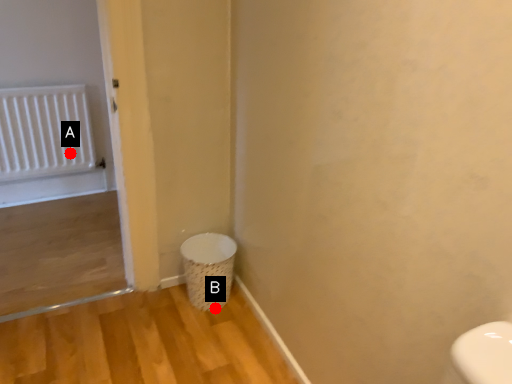
Question: Two points are circled on the image, labeled by A and B beside each circle. Which point appears closest to the camera in this image?

Choices:
 (A) A is closer
 (B) B is closer

Answer: (B)